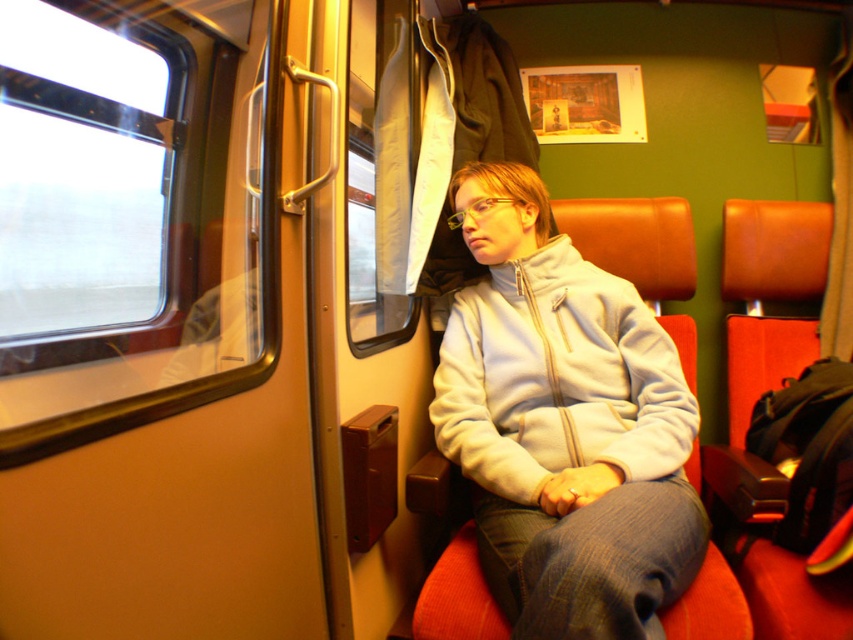
You are a passenger in the train carriage and want to look outside. Which window, the transparent glass window at left or the transparent plastic window at upper center, offers a better view?

The transparent glass window at left offers a better view because it has a larger size compared to the transparent plastic window at upper center.

You are a passenger on the train and want to know if you can reach the transparent plastic window at upper center while wearing the white fleece sweatshirt at center. Can you reach it?

The white fleece sweatshirt at center is shorter than the transparent plastic window at upper center, so yes, you can reach the transparent plastic window at upper center while wearing the white fleece sweatshirt at center since the sweatshirt does not obstruct your reach.